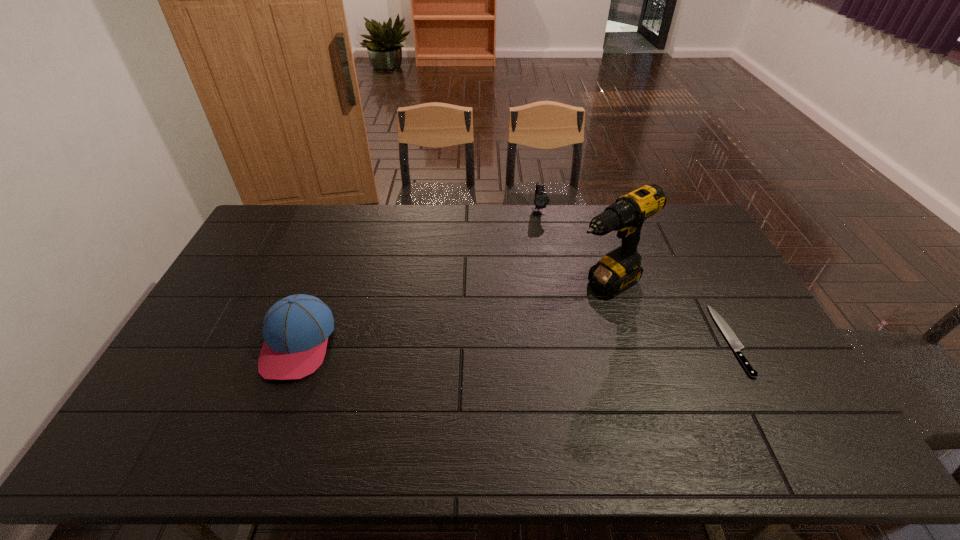
At what (x,y) coordinates should I click in order to perform the action: click on free space between the drill and the rightmost object. Please return your answer as a coordinate pair (x, y). This screenshot has height=540, width=960. Looking at the image, I should click on (668, 312).

Identify the location of empty location between the second object from right to left and the second object from left to right. (572, 248).

At what (x,y) coordinates should I click in order to perform the action: click on free point between the third object from left to right and the rightmost object. Please return your answer as a coordinate pair (x, y). Looking at the image, I should click on (668, 312).

Identify the location of object that is the closest to the third object from left to right. (731, 337).

What are the coordinates of `object that can be found as the second closest to the baseball cap` in the screenshot? It's located at (541, 199).

This screenshot has width=960, height=540. I want to click on free space that satisfies the following two spatial constraints: 1. on the front side of the second object from left to right; 2. on the left side of the rightmost object, so click(x=561, y=340).